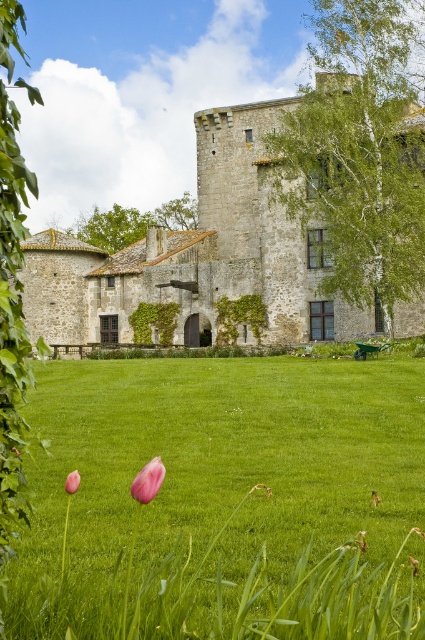
You are a gardener standing on the grassy lawn in front of the stone castle at center. You want to place a new pink matte tulip at lower center so that it is visible from the castle entrance. Considering their heights, will the new tulip be visible from the castle entrance?

The stone castle at center is taller than the pink matte tulip at lower center. Since the castle is taller, the tulip may be partially or fully obscured from the entrance view unless placed strategically to avoid the castle obstruction.